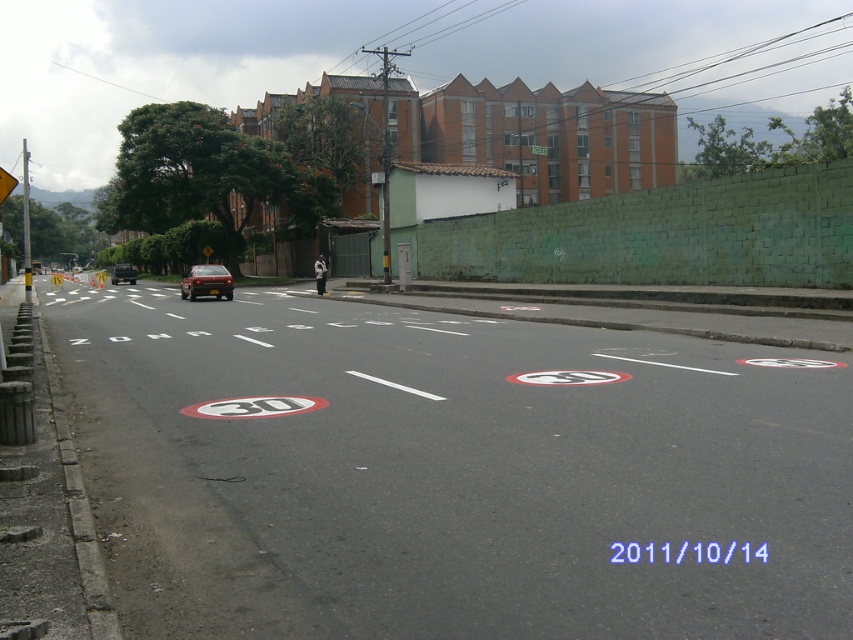
You are a delivery person trying to park your shiny metallic car at center in a spot between two objects. The space available is exactly the width of the green plastic traffic sign at upper center. Can your car fit into this space?

The shiny metallic car at center is wider than the green plastic traffic sign at upper center, so it cannot fit into a space that is only as wide as the sign.

You are a delivery driver who needs to park your shiny black sedan at center in this urban area. Based on the scene description, where exactly should you position your car to comply with traffic regulations?

The shiny black sedan at center should be positioned at the coordinates provided in the scene description, ensuring it adheres to the no parking zones indicated by the red circular signs and stays within legal parking areas.

You are a pedestrian standing at the sidewalk on the left side of the road. You see a shiny metallic car at center and a green plastic traffic sign at upper center. If you want to walk to the closest object between them, which one should you head towards?

The distance between the shiny metallic car at center and the green plastic traffic sign at upper center is 38.32 meters. Since the question asks for the closest object from your current position on the sidewalk, the answer depends on your exact location. However, based on the given information alone, we cannot determine which is closer to you.